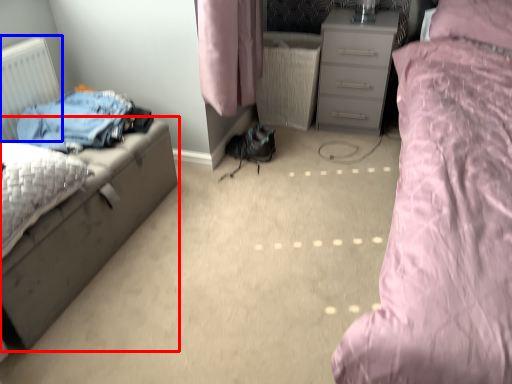
Question: Which object appears closest to the camera in this image, nightstand (highlighted by a red box) or radiator (highlighted by a blue box)?

Choices:
 (A) nightstand
 (B) radiator

Answer: (A)